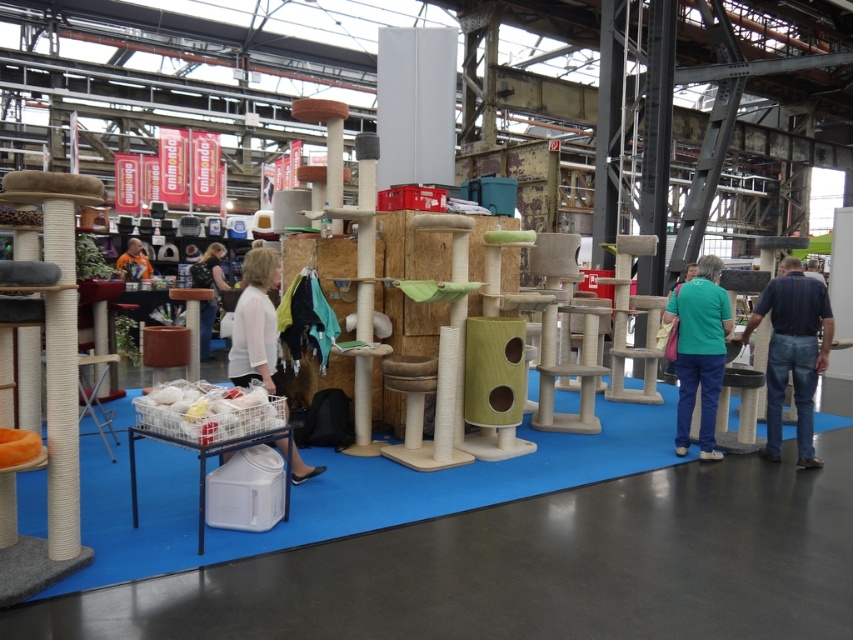
Question: Estimate the real-world distances between objects in this image. Which object is farther from the light brown hair at center?

Choices:
 (A) green matte shirt at center
 (B) white fabric at center
 (C) orange fabric at center

Answer: (A)

Question: Is teal fabric pants at center below green matte shirt at center?

Choices:
 (A) yes
 (B) no

Answer: (A)

Question: Is white fabric at center smaller than orange fabric at center?

Choices:
 (A) no
 (B) yes

Answer: (A)

Question: Which object is positioned farthest from the orange fabric at center?

Choices:
 (A) blue jeans at right
 (B) white fabric at center
 (C) green matte shirt at center

Answer: (A)

Question: Which point is closer to the camera?

Choices:
 (A) (772, 416)
 (B) (691, 328)

Answer: (B)

Question: Where is white fabric at center located in relation to green matte shirt at center in the image?

Choices:
 (A) right
 (B) left

Answer: (B)